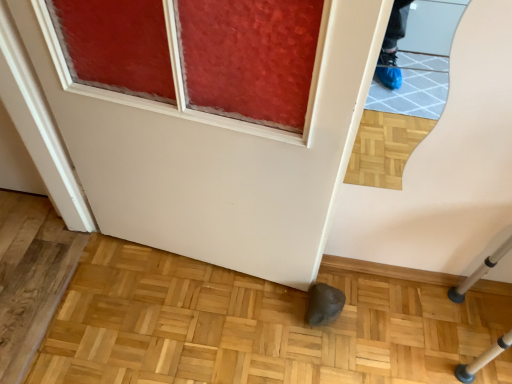
Locate an element on the screen. The height and width of the screenshot is (384, 512). vacant region below silver metallic crutch at lower right (from a real-world perspective) is located at coordinates (482, 333).